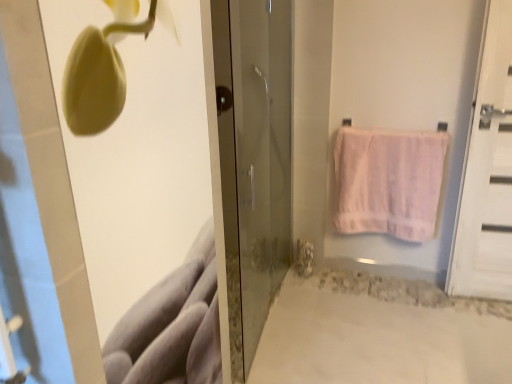
Question: Is pink cotton towel at right oriented towards transparent glass door at center, which is the second door in right-to-left order?

Choices:
 (A) no
 (B) yes

Answer: (A)

Question: Is pink cotton towel at right not within transparent glass door at center, which is the second door in right-to-left order?

Choices:
 (A) no
 (B) yes

Answer: (B)

Question: Considering the relative sizes of pink cotton towel at right and transparent glass door at center, arranged as the first door when viewed from the left, in the image provided, is pink cotton towel at right bigger than transparent glass door at center, arranged as the first door when viewed from the left,?

Choices:
 (A) yes
 (B) no

Answer: (B)

Question: Is pink cotton towel at right positioned far away from transparent glass door at center, arranged as the first door when viewed from the left?

Choices:
 (A) yes
 (B) no

Answer: (B)

Question: Does pink cotton towel at right appear on the left side of transparent glass door at center, which is the second door in right-to-left order?

Choices:
 (A) yes
 (B) no

Answer: (B)

Question: Is transparent glass door at center, which is the second door in right-to-left order, to the left or to the right of white wooden door at right, which ranks as the second door in left-to-right order, in the image?

Choices:
 (A) right
 (B) left

Answer: (B)

Question: Is transparent glass door at center, arranged as the first door when viewed from the left, in front of or behind white wooden door at right, which ranks as the second door in left-to-right order, in the image?

Choices:
 (A) front
 (B) behind

Answer: (A)

Question: Considering the positions of transparent glass door at center, which is the second door in right-to-left order, and white wooden door at right, which ranks as the second door in left-to-right order, in the image, is transparent glass door at center, which is the second door in right-to-left order, bigger or smaller than white wooden door at right, which ranks as the second door in left-to-right order,?

Choices:
 (A) small
 (B) big

Answer: (B)

Question: Do you think transparent glass door at center, arranged as the first door when viewed from the left, is within white wooden door at right, marked as the 1th door in a right-to-left arrangement, or outside of it?

Choices:
 (A) outside
 (B) inside

Answer: (A)

Question: Considering the positions of pink cotton towel at right and white wooden door at right, which ranks as the second door in left-to-right order, in the image, is pink cotton towel at right taller or shorter than white wooden door at right, which ranks as the second door in left-to-right order,?

Choices:
 (A) tall
 (B) short

Answer: (B)

Question: From a real-world perspective, is pink cotton towel at right above or below white wooden door at right, marked as the 1th door in a right-to-left arrangement?

Choices:
 (A) above
 (B) below

Answer: (B)

Question: Would you say pink cotton towel at right is inside or outside white wooden door at right, marked as the 1th door in a right-to-left arrangement?

Choices:
 (A) inside
 (B) outside

Answer: (B)

Question: Does point (x=362, y=198) appear closer or farther from the camera than point (x=499, y=291)?

Choices:
 (A) closer
 (B) farther

Answer: (B)

Question: Is white wooden door at right, marked as the 1th door in a right-to-left arrangement, taller or shorter than transparent glass door at center, arranged as the first door when viewed from the left?

Choices:
 (A) tall
 (B) short

Answer: (B)

Question: From the image's perspective, relative to transparent glass door at center, which is the second door in right-to-left order, is white wooden door at right, which ranks as the second door in left-to-right order, above or below?

Choices:
 (A) below
 (B) above

Answer: (B)